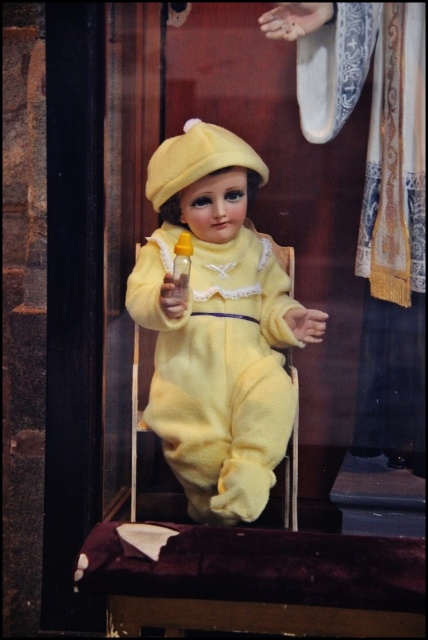
Does yellow plush doll at center have a lesser width compared to translucent yellow bottle at center?

Incorrect, yellow plush doll at center's width is not less than translucent yellow bottle at center's.

Between yellow plush doll at center and translucent yellow bottle at center, which one is positioned higher?

translucent yellow bottle at center

I want to click on yellow plush doll at center, so click(216, 326).